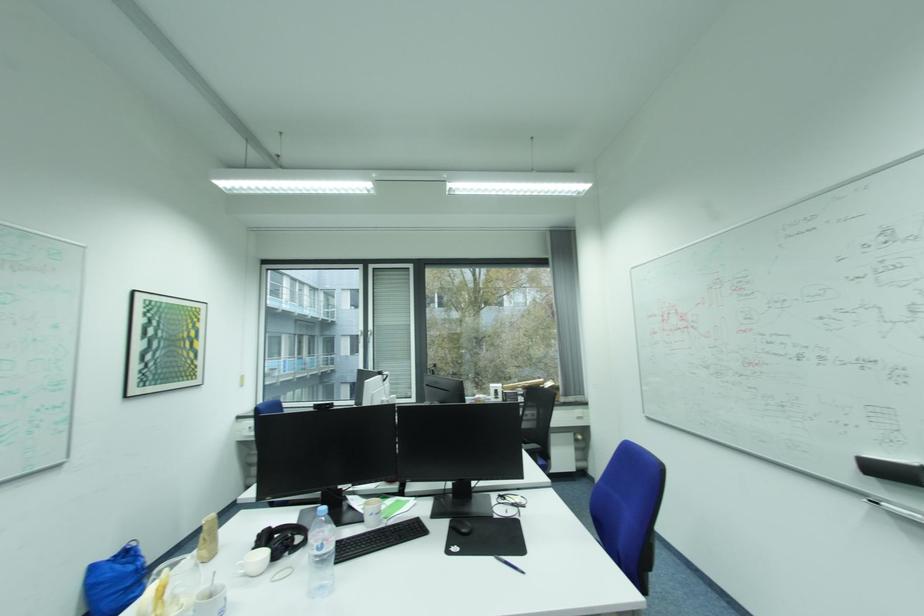
Where would you grip the black computer mouse? Please return your answer as a coordinate pair (x, y).

(460, 525)